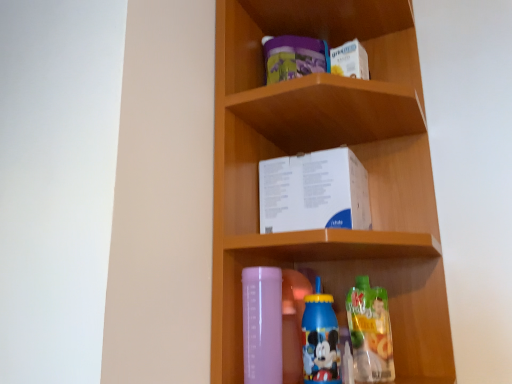
Question: Does matte plastic box at center touch blue plastic bottle at lower center, the second bottle in the right-to-left sequence?

Choices:
 (A) yes
 (B) no

Answer: (B)

Question: Would you say blue plastic bottle at lower center, the second bottle in the right-to-left sequence, is part of matte plastic box at center's contents?

Choices:
 (A) no
 (B) yes

Answer: (B)

Question: Does matte plastic box at center have a larger size compared to blue plastic bottle at lower center, the second bottle in the right-to-left sequence?

Choices:
 (A) yes
 (B) no

Answer: (A)

Question: Is matte plastic box at center wider than blue plastic bottle at lower center, the second bottle in the right-to-left sequence?

Choices:
 (A) yes
 (B) no

Answer: (A)

Question: Is matte plastic box at center facing towards blue plastic bottle at lower center, the second bottle in the right-to-left sequence?

Choices:
 (A) no
 (B) yes

Answer: (B)

Question: In the image, is matte plastic box at center positioned in front of or behind white paper box at center?

Choices:
 (A) front
 (B) behind

Answer: (A)

Question: Which is correct: matte plastic box at center is inside white paper box at center, or outside of it?

Choices:
 (A) outside
 (B) inside

Answer: (A)

Question: Visually, is matte plastic box at center positioned to the left or to the right of white paper box at center?

Choices:
 (A) right
 (B) left

Answer: (B)

Question: From the image's perspective, is matte plastic box at center located above or below white paper box at center?

Choices:
 (A) below
 (B) above

Answer: (B)

Question: From the image's perspective, is translucent plastic juice at lower right, which is the 1th bottle from right to left, above or below blue plastic bottle at lower center, which appears as the second bottle when viewed from the left?

Choices:
 (A) below
 (B) above

Answer: (A)

Question: In terms of height, does translucent plastic juice at lower right, which is the 1th bottle from right to left, look taller or shorter compared to blue plastic bottle at lower center, which appears as the second bottle when viewed from the left?

Choices:
 (A) short
 (B) tall

Answer: (A)

Question: Is point (388, 311) positioned closer to the camera than point (311, 309)?

Choices:
 (A) closer
 (B) farther

Answer: (B)

Question: Is translucent plastic juice at lower right, which is the third bottle in left-to-right order, in front of or behind blue plastic bottle at lower center, which appears as the second bottle when viewed from the left, in the image?

Choices:
 (A) behind
 (B) front

Answer: (A)

Question: From the image's perspective, relative to transparent plastic bottle at lower center, marked as the third bottle in a right-to-left arrangement, is matte plastic box at center above or below?

Choices:
 (A) below
 (B) above

Answer: (B)

Question: Is point (417, 56) closer or farther from the camera than point (261, 375)?

Choices:
 (A) farther
 (B) closer

Answer: (A)